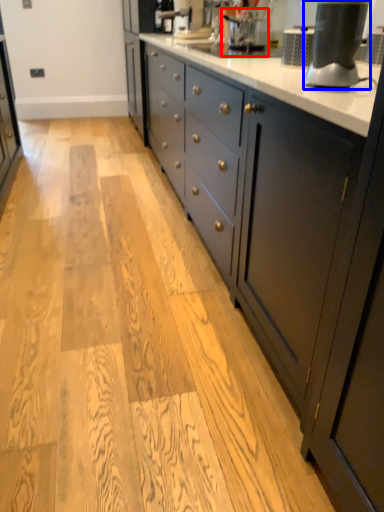
Question: Among these objects, which one is farthest to the camera, coffee machine (highlighted by a red box) or home appliance (highlighted by a blue box)?

Choices:
 (A) coffee machine
 (B) home appliance

Answer: (A)